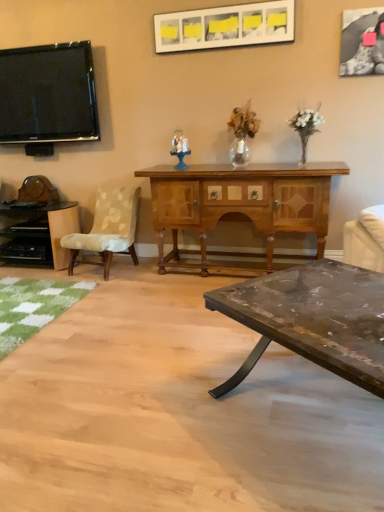
Find the location of a particular element. This screenshot has height=512, width=384. green knitted rug at lower left is located at coordinates (33, 306).

You are a GUI agent. You are given a task and a screenshot of the screen. Output one action in this format:
    pyautogui.click(x=<x>, y=<y>)
    Task: Click on the black glossy desk at left, the second desk in the right-to-left sequence
    The image size is (384, 512).
    Given the screenshot: What is the action you would take?
    pyautogui.click(x=38, y=233)

Image resolution: width=384 pixels, height=512 pixels. I want to click on black textured fabric picture frame at upper right, positioned as the second picture frame in left-to-right order, so click(x=362, y=42).

Locate an element on the screen. Image resolution: width=384 pixels, height=512 pixels. flat screen tv at upper left is located at coordinates (48, 94).

The height and width of the screenshot is (512, 384). What are the coordinates of `green knitted rug at lower left` in the screenshot? It's located at (33, 306).

Is point (380, 253) positioned in front of point (353, 38)?

Yes, point (380, 253) is closer to viewer.

Is white fabric couch at right facing towards black textured fabric picture frame at upper right, positioned as the 1th picture frame in right-to-left order?

No, white fabric couch at right is not facing towards black textured fabric picture frame at upper right, positioned as the 1th picture frame in right-to-left order.

How many degrees apart are the facing directions of white fabric couch at right and black textured fabric picture frame at upper right, positioned as the 1th picture frame in right-to-left order?

The angle between the facing direction of white fabric couch at right and the facing direction of black textured fabric picture frame at upper right, positioned as the 1th picture frame in right-to-left order, is 51.4 degrees.

Image resolution: width=384 pixels, height=512 pixels. Find the location of `studio couch in front of the black textured fabric picture frame at upper right, positioned as the second picture frame in left-to-right order`. studio couch in front of the black textured fabric picture frame at upper right, positioned as the second picture frame in left-to-right order is located at coordinates (365, 239).

Between white glossy picture frame at upper center, acting as the 1th picture frame starting from the left, and rustic wood coffee table at lower right, which one has more height?

rustic wood coffee table at lower right is taller.

What's the angular difference between white glossy picture frame at upper center, arranged as the 2th picture frame when viewed from the right, and rustic wood coffee table at lower right's facing directions?

41.5 degrees.

Considering the sizes of white glossy picture frame at upper center, acting as the 1th picture frame starting from the left, and rustic wood coffee table at lower right in the image, is white glossy picture frame at upper center, acting as the 1th picture frame starting from the left, wider or thinner than rustic wood coffee table at lower right?

In the image, white glossy picture frame at upper center, acting as the 1th picture frame starting from the left, appears to be more narrow than rustic wood coffee table at lower right.

Looking at this image, can rustic wood coffee table at lower right be found inside beige fabric chair at left?

No, rustic wood coffee table at lower right is not inside beige fabric chair at left.

Considering the sizes of objects beige fabric chair at left and rustic wood coffee table at lower right in the image provided, who is shorter, beige fabric chair at left or rustic wood coffee table at lower right?

rustic wood coffee table at lower right is shorter.

Considering the positions of objects beige fabric chair at left and rustic wood coffee table at lower right in the image provided, who is in front, beige fabric chair at left or rustic wood coffee table at lower right?

rustic wood coffee table at lower right is closer to the camera.

Could you tell me if beige fabric chair at left is turned towards rustic wood coffee table at lower right?

No, beige fabric chair at left is not facing towards rustic wood coffee table at lower right.

From the image's perspective, is black textured fabric picture frame at upper right, positioned as the second picture frame in left-to-right order, over flat screen tv at upper left?

Yes.

The width and height of the screenshot is (384, 512). I want to click on television below the black textured fabric picture frame at upper right, positioned as the 1th picture frame in right-to-left order (from the image's perspective), so click(x=48, y=94).

From a real-world perspective, is black textured fabric picture frame at upper right, positioned as the 1th picture frame in right-to-left order, physically located above or below flat screen tv at upper left?

From a real-world perspective, black textured fabric picture frame at upper right, positioned as the 1th picture frame in right-to-left order, is physically above flat screen tv at upper left.

Which is more to the left, black textured fabric picture frame at upper right, positioned as the 1th picture frame in right-to-left order, or flat screen tv at upper left?

Positioned to the left is flat screen tv at upper left.

In the scene shown: Is wooden cabinet at center, which is counted as the 1th desk, starting from the right, not close to flat screen tv at upper left?

Yes, wooden cabinet at center, which is counted as the 1th desk, starting from the right, and flat screen tv at upper left are quite far apart.

Is wooden cabinet at center, which is counted as the 1th desk, starting from the right, to the left or to the right of flat screen tv at upper left in the image?

wooden cabinet at center, which is counted as the 1th desk, starting from the right, is to the right of flat screen tv at upper left.

Is wooden cabinet at center, the 2th desk viewed from the left, behind flat screen tv at upper left?

No.

From the image's perspective, is white glossy picture frame at upper center, acting as the 1th picture frame starting from the left, above or below beige fabric chair at left?

white glossy picture frame at upper center, acting as the 1th picture frame starting from the left, is above beige fabric chair at left.

Which is more to the right, white glossy picture frame at upper center, arranged as the 2th picture frame when viewed from the right, or beige fabric chair at left?

white glossy picture frame at upper center, arranged as the 2th picture frame when viewed from the right.

What's the angular difference between white glossy picture frame at upper center, acting as the 1th picture frame starting from the left, and beige fabric chair at left's facing directions?

11.7 degrees.

Would you consider translucent glass figurine at center to be distant from green knitted rug at lower left?

translucent glass figurine at center is positioned a significant distance from green knitted rug at lower left.

Is translucent glass figurine at center aimed at green knitted rug at lower left?

No, translucent glass figurine at center is not facing towards green knitted rug at lower left.

Looking at this image, between translucent glass figurine at center and green knitted rug at lower left, which one has larger size?

green knitted rug at lower left is bigger.

There is a white fabric couch at right. At what (x,y) coordinates should I click in order to perform the action: click on the 1st picture frame above it (from a real-world perspective). Please return your answer as a coordinate pair (x, y). Looking at the image, I should click on (362, 42).

Where is `coffee table that is under the white glossy picture frame at upper center, arranged as the 2th picture frame when viewed from the right (from a real-world perspective)`? This screenshot has height=512, width=384. coffee table that is under the white glossy picture frame at upper center, arranged as the 2th picture frame when viewed from the right (from a real-world perspective) is located at coordinates (313, 319).

When comparing their distances from flat screen tv at upper left, does wooden cabinet at center, the 2th desk viewed from the left, or black textured fabric picture frame at upper right, positioned as the 1th picture frame in right-to-left order, seem closer?

wooden cabinet at center, the 2th desk viewed from the left.

Looking at the image, which one is located further to wooden cabinet at center, the 2th desk viewed from the left, rustic wood coffee table at lower right or translucent glass figurine at center?

rustic wood coffee table at lower right is positioned further to the anchor wooden cabinet at center, the 2th desk viewed from the left.

Based on their spatial positions, is flat screen tv at upper left or rustic wood coffee table at lower right further from green knitted rug at lower left?

flat screen tv at upper left is further to green knitted rug at lower left.

When comparing their distances from black glossy desk at left, the second desk in the right-to-left sequence, does white fabric couch at right or black textured fabric picture frame at upper right, positioned as the 1th picture frame in right-to-left order, seem further?

black textured fabric picture frame at upper right, positioned as the 1th picture frame in right-to-left order, is further to black glossy desk at left, the second desk in the right-to-left sequence.

Looking at the image, which one is located further to wooden cabinet at center, the 2th desk viewed from the left, white glossy picture frame at upper center, acting as the 1th picture frame starting from the left, or rustic wood coffee table at lower right?

rustic wood coffee table at lower right lies further to wooden cabinet at center, the 2th desk viewed from the left, than the other object.

When comparing their distances from wooden cabinet at center, which is counted as the 1th desk, starting from the right, does beige fabric chair at left or rustic wood coffee table at lower right seem closer?

beige fabric chair at left is positioned closer to the anchor wooden cabinet at center, which is counted as the 1th desk, starting from the right.

From the image, which object appears to be farther from rustic wood coffee table at lower right, black glossy desk at left, the 1th desk viewed from the left, or flat screen tv at upper left?

flat screen tv at upper left is positioned further to the anchor rustic wood coffee table at lower right.

Estimate the real-world distances between objects in this image. Which object is further from green knitted rug at lower left, white fabric couch at right or flat screen tv at upper left?

white fabric couch at right is further to green knitted rug at lower left.

Where is `television situated between black glossy desk at left, the second desk in the right-to-left sequence, and white glossy picture frame at upper center, arranged as the 2th picture frame when viewed from the right, from left to right`? This screenshot has width=384, height=512. television situated between black glossy desk at left, the second desk in the right-to-left sequence, and white glossy picture frame at upper center, arranged as the 2th picture frame when viewed from the right, from left to right is located at coordinates click(x=48, y=94).

Identify the location of coffee table situated between flat screen tv at upper left and white fabric couch at right from left to right. (313, 319).

Locate an element on the screen. person situated between beige fabric chair at left and black textured fabric picture frame at upper right, positioned as the 1th picture frame in right-to-left order, from left to right is located at coordinates (180, 149).

Find the location of a particular element. The height and width of the screenshot is (512, 384). person located between flat screen tv at upper left and black textured fabric picture frame at upper right, positioned as the second picture frame in left-to-right order, in the left-right direction is located at coordinates (180, 149).